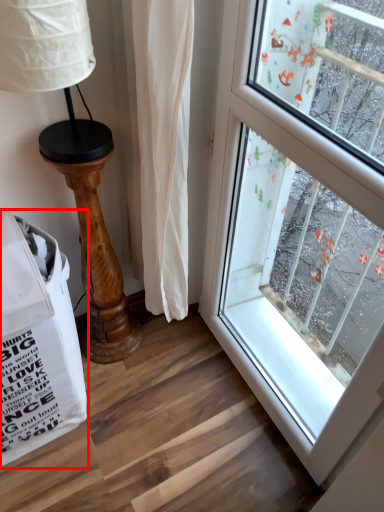
Question: From the image's perspective, what is the correct spatial positioning of grocery bag (annotated by the red box) in reference to table lamp?

Choices:
 (A) above
 (B) below

Answer: (B)